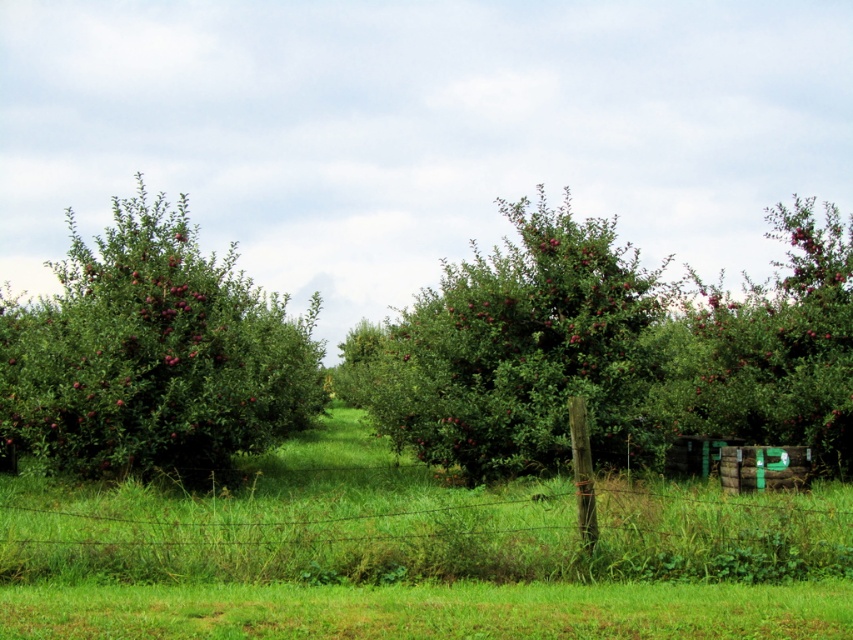
Does barbed wire fence at lower center have a lesser height compared to green leafy tree at center?

Yes, barbed wire fence at lower center is shorter than green leafy tree at center.

Is barbed wire fence at lower center to the left of green leafy tree at center from the viewer's perspective?

Correct, you'll find barbed wire fence at lower center to the left of green leafy tree at center.

Between point (570, 573) and point (544, 371), which one is positioned behind?

Positioned behind is point (544, 371).

Image resolution: width=853 pixels, height=640 pixels. Identify the location of barbed wire fence at lower center. (416, 529).

Describe the element at coordinates (416, 529) in the screenshot. I see `barbed wire fence at lower center` at that location.

Is the position of barbed wire fence at lower center more distant than that of shiny red apples at left?

No.

Between point (564, 516) and point (194, 323), which one is positioned in front?

Positioned in front is point (564, 516).

Where is `barbed wire fence at lower center`? The height and width of the screenshot is (640, 853). barbed wire fence at lower center is located at coordinates (416, 529).

Who is shorter, barbed wire fence at lower center or smooth green crate at center?

Standing shorter between the two is barbed wire fence at lower center.

Between barbed wire fence at lower center and smooth green crate at center, which one is positioned lower?

barbed wire fence at lower center is lower down.

The image size is (853, 640). Find the location of `barbed wire fence at lower center`. barbed wire fence at lower center is located at coordinates (416, 529).

At what (x,y) coordinates should I click in order to perform the action: click on barbed wire fence at lower center. Please return your answer as a coordinate pair (x, y). Looking at the image, I should click on (416, 529).